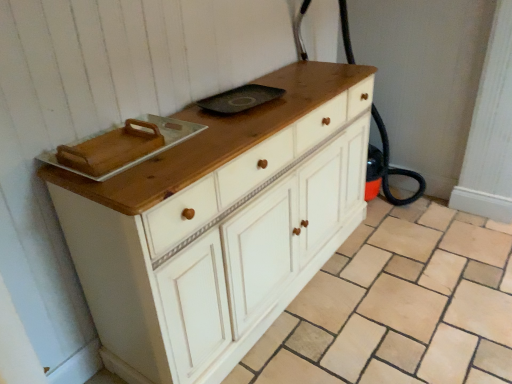
Question: Is white wood chest of drawers at center inside the boundaries of white wood cabinet at center, or outside?

Choices:
 (A) outside
 (B) inside

Answer: (A)

Question: Considering the relative positions of white wood chest of drawers at center and white wood cabinet at center in the image provided, is white wood chest of drawers at center to the left or to the right of white wood cabinet at center?

Choices:
 (A) right
 (B) left

Answer: (B)

Question: Considering the positions of point (161, 253) and point (438, 354), is point (161, 253) closer or farther from the camera than point (438, 354)?

Choices:
 (A) farther
 (B) closer

Answer: (B)

Question: Considering the positions of point (307, 291) and point (211, 230), is point (307, 291) closer or farther from the camera than point (211, 230)?

Choices:
 (A) closer
 (B) farther

Answer: (B)

Question: Considering the relative positions of white wood cabinet at center and white wood chest of drawers at center in the image provided, is white wood cabinet at center to the left or to the right of white wood chest of drawers at center?

Choices:
 (A) right
 (B) left

Answer: (A)

Question: From the image's perspective, is white wood cabinet at center located above or below white wood chest of drawers at center?

Choices:
 (A) below
 (B) above

Answer: (A)

Question: Is white wood cabinet at center bigger or smaller than white wood chest of drawers at center?

Choices:
 (A) small
 (B) big

Answer: (A)